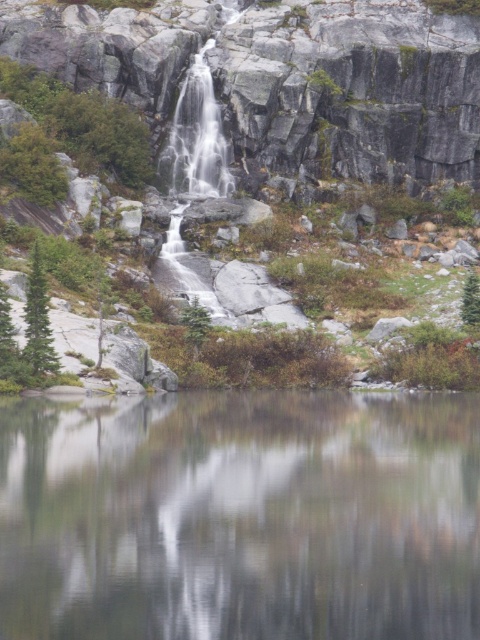
You are standing at the edge of the waterfall and see the smooth reflective water at center and the green matte tree at center. Which object is located to the right?

The green matte tree at center is located to the right of the smooth reflective water at center.

You are standing at the base of the waterfall and want to reach the two points marked in the image. Which point, point (352, 404) or point (349, 116), is closer to you?

Point (352, 404) is closer to the viewer than point (349, 116), so you would reach point (352, 404) first.